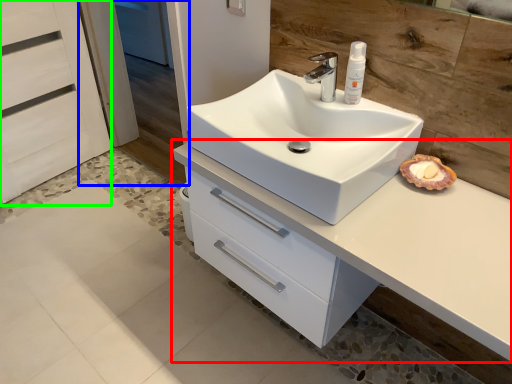
Question: Which object is positioned closest to bathroom cabinet (highlighted by a red box)? Select from screen door (highlighted by a blue box) and screen door (highlighted by a green box).

Choices:
 (A) screen door
 (B) screen door

Answer: (B)